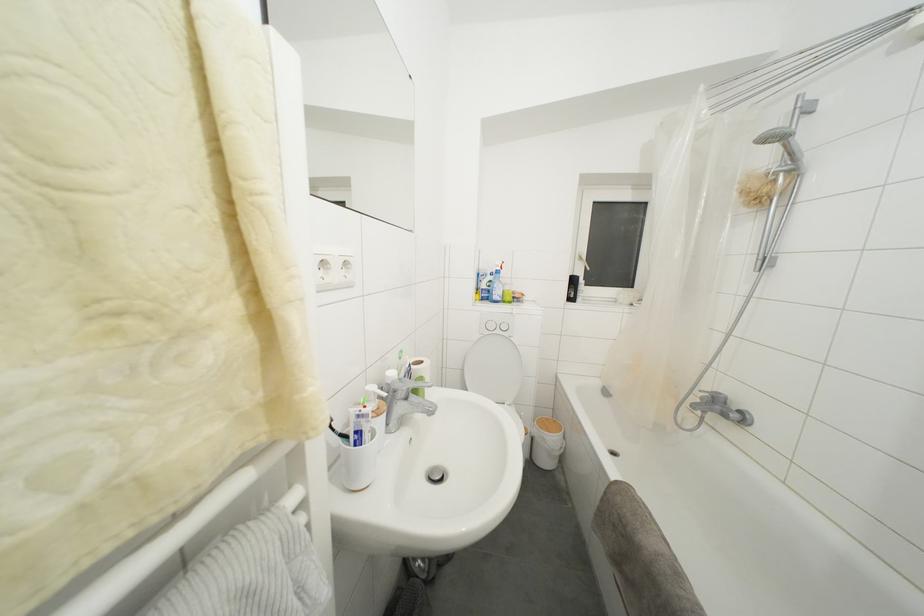
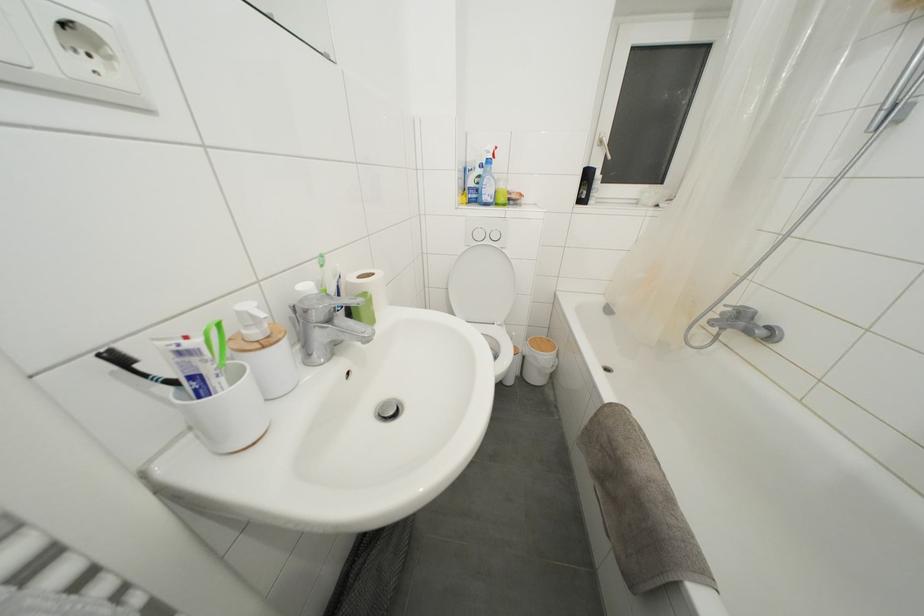
Where in the second image is the point corresponding to the point at 362,421 from the first image?

(185, 358)